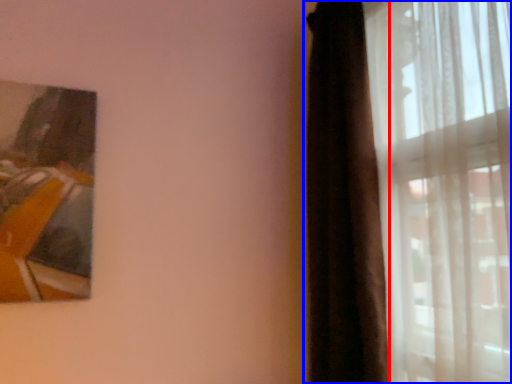
Question: Among these objects, which one is nearest to the camera, curtain (highlighted by a red box) or curtain (highlighted by a blue box)?

Choices:
 (A) curtain
 (B) curtain

Answer: (B)